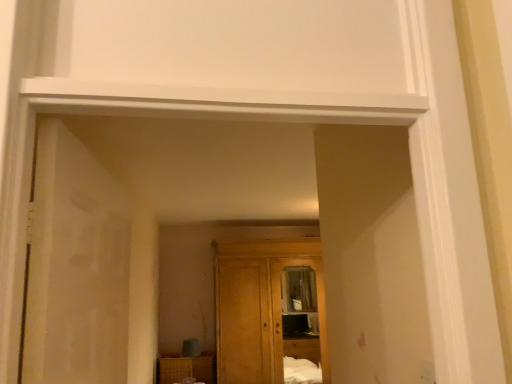
The height and width of the screenshot is (384, 512). What do you see at coordinates (186, 369) in the screenshot?
I see `woven wood cabinet at lower center` at bounding box center [186, 369].

This screenshot has height=384, width=512. Find the location of `white matte door at left`. white matte door at left is located at coordinates (78, 261).

Which object is further away from the camera, woven wood cabinet at lower center or white matte door at left?

woven wood cabinet at lower center.

Is woven wood cabinet at lower center facing away from white matte door at left?

No.

Are woven wood cabinet at lower center and white matte door at left located far from each other?

woven wood cabinet at lower center is positioned a significant distance from white matte door at left.

Does point (169, 377) lie in front of point (106, 350)?

No, it is behind (106, 350).

Considering the positions of objects woven wood cabinet at lower center and wooden wardrobe at center in the image provided, who is behind, woven wood cabinet at lower center or wooden wardrobe at center?

woven wood cabinet at lower center is further away from the camera.

Can you tell me how much woven wood cabinet at lower center and wooden wardrobe at center differ in facing direction?

There is a 1.49-degree angle between the facing directions of woven wood cabinet at lower center and wooden wardrobe at center.

Is wooden wardrobe at center at the back of woven wood cabinet at lower center?

No, wooden wardrobe at center is not at the back of woven wood cabinet at lower center.

In the scene shown: Considering the positions of objects woven wood cabinet at lower center and wooden wardrobe at center in the image provided, who is more to the left, woven wood cabinet at lower center or wooden wardrobe at center?

From the viewer's perspective, woven wood cabinet at lower center appears more on the left side.

Are white matte door at left and wooden wardrobe at center making contact?

There is a gap between white matte door at left and wooden wardrobe at center.

Based on their sizes in the image, would you say white matte door at left is bigger or smaller than wooden wardrobe at center?

Considering their sizes, white matte door at left takes up less space than wooden wardrobe at center.

Which point is more distant from viewer, (38, 298) or (231, 383)?

Point (231, 383)

How far apart are white matte door at left and wooden wardrobe at center?

white matte door at left and wooden wardrobe at center are 10.78 feet apart from each other.

From the image's perspective, which object appears higher, wooden wardrobe at center or woven wood cabinet at lower center?

wooden wardrobe at center, from the image's perspective.

What's the angular difference between wooden wardrobe at center and woven wood cabinet at lower center's facing directions?

1.49 degrees.

Based on the photo, could you tell me if wooden wardrobe at center is facing woven wood cabinet at lower center?

No, wooden wardrobe at center is not aimed at woven wood cabinet at lower center.

Is wooden wardrobe at center not within white matte door at left?

Yes, wooden wardrobe at center is not within white matte door at left.

Is wooden wardrobe at center turned away from white matte door at left?

That's not correct — wooden wardrobe at center is not looking away from white matte door at left.

Is there a large distance between wooden wardrobe at center and white matte door at left?

Yes.

From the image's perspective, which one is positioned lower, white matte door at left or woven wood cabinet at lower center?

woven wood cabinet at lower center is shown below in the image.

Which of these two, white matte door at left or woven wood cabinet at lower center, is wider?

woven wood cabinet at lower center.

Is white matte door at left to the left or to the right of woven wood cabinet at lower center in the image?

Based on their positions, white matte door at left is located to the right of woven wood cabinet at lower center.

Which point is more forward, (56, 372) or (205, 374)?

Point (56, 372)

I want to click on cabinetry below the white matte door at left (from a real-world perspective), so click(186, 369).

The image size is (512, 384). What are the coordinates of `cupboard lying in front of the woven wood cabinet at lower center` in the screenshot? It's located at (260, 306).

Considering their positions, is wooden wardrobe at center positioned further to white matte door at left than woven wood cabinet at lower center?

The object further to white matte door at left is woven wood cabinet at lower center.

Which object lies nearer to the anchor point wooden wardrobe at center, white matte door at left or woven wood cabinet at lower center?

woven wood cabinet at lower center is closer to wooden wardrobe at center.

When comparing their distances from wooden wardrobe at center, does woven wood cabinet at lower center or white matte door at left seem further?

The object further to wooden wardrobe at center is white matte door at left.

Based on their spatial positions, is woven wood cabinet at lower center or wooden wardrobe at center closer to white matte door at left?

wooden wardrobe at center is positioned closer to the anchor white matte door at left.

In the scene shown: Considering their positions, is white matte door at left positioned closer to woven wood cabinet at lower center than wooden wardrobe at center?

wooden wardrobe at center lies closer to woven wood cabinet at lower center than the other object.

When comparing their distances from woven wood cabinet at lower center, does wooden wardrobe at center or white matte door at left seem closer?

Among the two, wooden wardrobe at center is located nearer to woven wood cabinet at lower center.

This screenshot has width=512, height=384. I want to click on cupboard positioned between white matte door at left and woven wood cabinet at lower center from near to far, so click(x=260, y=306).